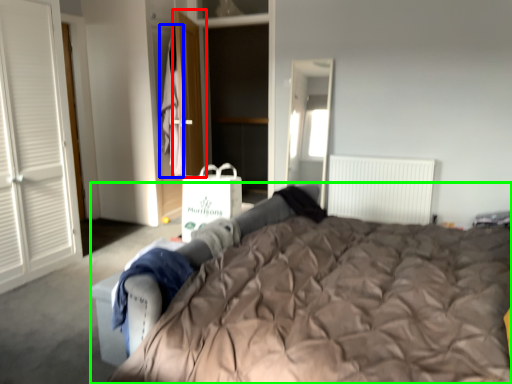
Question: Which is nearer to the door (highlighted by a red box)? laundry (highlighted by a blue box) or bed (highlighted by a green box).

Choices:
 (A) laundry
 (B) bed

Answer: (A)